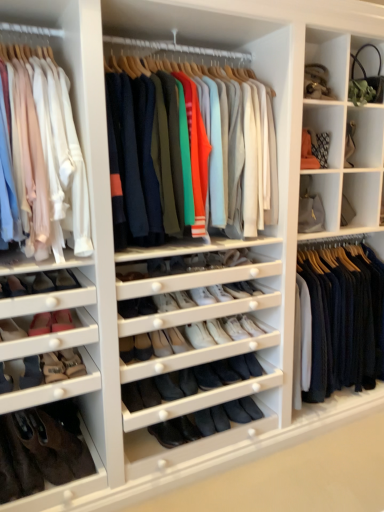
What do you see at coordinates (72, 362) in the screenshot?
I see `suede brown shoe at lower left, which is the 7th shoe in left-to-right order` at bounding box center [72, 362].

Measure the distance between brown suede shoe at lower left, arranged as the 8th shoe when viewed from the right, and camera.

brown suede shoe at lower left, arranged as the 8th shoe when viewed from the right, is 1.83 meters from camera.

Measure the distance between point (18, 326) and camera.

The depth of point (18, 326) is 6.13 feet.

Where is `matte white shirts at left, arranged as the first clothing when viewed from the left`? Image resolution: width=384 pixels, height=512 pixels. matte white shirts at left, arranged as the first clothing when viewed from the left is located at coordinates (47, 157).

Describe the element at coordinates (250, 325) in the screenshot. I see `white leather shoe at center, the 1th shoe when ordered from right to left` at that location.

Locate an element on the screen. The image size is (384, 512). suede brown shoe at lower left, the 4th shoe positioned from the right is located at coordinates (72, 362).

The image size is (384, 512). Find the location of `the 2nd clothing to the right of the matte white shirts at left, the third clothing viewed from the right, counting from the anchor's position`. the 2nd clothing to the right of the matte white shirts at left, the third clothing viewed from the right, counting from the anchor's position is located at coordinates (344, 318).

From a real-world perspective, who is located higher, dark blue knit sweater at center right, which is the 3th clothing from left to right, or matte white shirts at left, arranged as the first clothing when viewed from the left?

matte white shirts at left, arranged as the first clothing when viewed from the left, from a real-world perspective.

Considering the relative positions of dark blue knit sweater at center right, positioned as the first clothing in right-to-left order, and matte white shirts at left, arranged as the first clothing when viewed from the left, in the image provided, is dark blue knit sweater at center right, positioned as the first clothing in right-to-left order, to the left of matte white shirts at left, arranged as the first clothing when viewed from the left, from the viewer's perspective?

Incorrect, dark blue knit sweater at center right, positioned as the first clothing in right-to-left order, is not on the left side of matte white shirts at left, arranged as the first clothing when viewed from the left.

Between dark blue knit sweater at center right, positioned as the first clothing in right-to-left order, and matte white shirts at left, arranged as the first clothing when viewed from the left, which one is positioned behind?

Positioned behind is dark blue knit sweater at center right, positioned as the first clothing in right-to-left order.

Which is in front, matte pink shoe at lower left, positioned as the 6th shoe in right-to-left order, or black suede shoe at center, arranged as the third shoe when viewed from the right?

matte pink shoe at lower left, positioned as the 6th shoe in right-to-left order, is in front.

Consider the image. Is matte pink shoe at lower left, positioned as the 6th shoe in right-to-left order, with black suede shoe at center, arranged as the eighth shoe when viewed from the left?

No.

Which of these two, matte pink shoe at lower left, which is counted as the 5th shoe, starting from the left, or black suede shoe at center, arranged as the third shoe when viewed from the right, stands shorter?

black suede shoe at center, arranged as the third shoe when viewed from the right.

How many degrees apart are the facing directions of matte pink shoe at lower left, which is counted as the 5th shoe, starting from the left, and black suede shoe at center, arranged as the eighth shoe when viewed from the left?

They differ by 7.49 degrees in their facing directions.

Who is bigger, leather boot at lower left or matte pink shoe at lower left, which is counted as the seventh shoe, starting from the right?

With larger size is leather boot at lower left.

From a real-world perspective, is leather boot at lower left above or below matte pink shoe at lower left, which is counted as the seventh shoe, starting from the right?

leather boot at lower left is situated lower than matte pink shoe at lower left, which is counted as the seventh shoe, starting from the right, in the real world.

Is leather boot at lower left next to matte pink shoe at lower left, which is counted as the seventh shoe, starting from the right?

leather boot at lower left is not next to matte pink shoe at lower left, which is counted as the seventh shoe, starting from the right, and they're not touching.

Which object is further away from the camera, leather boot at lower left or matte pink shoe at lower left, placed as the fourth shoe when sorted from left to right?

leather boot at lower left.

Is matte pink shoe at lower left, which is counted as the seventh shoe, starting from the right, positioned beyond the bounds of black suede shoe at center, arranged as the third shoe when viewed from the right?

Yes, matte pink shoe at lower left, which is counted as the seventh shoe, starting from the right, is outside of black suede shoe at center, arranged as the third shoe when viewed from the right.

Based on the photo, is there a large distance between matte pink shoe at lower left, which is counted as the seventh shoe, starting from the right, and black suede shoe at center, arranged as the eighth shoe when viewed from the left?

Yes, matte pink shoe at lower left, which is counted as the seventh shoe, starting from the right, and black suede shoe at center, arranged as the eighth shoe when viewed from the left, are quite far apart.

Between matte pink shoe at lower left, placed as the fourth shoe when sorted from left to right, and black suede shoe at center, arranged as the third shoe when viewed from the right, which one is positioned behind?

black suede shoe at center, arranged as the third shoe when viewed from the right, is further from the camera.

Which object is wider, matte pink shoe at lower left, placed as the fourth shoe when sorted from left to right, or black suede shoe at center, arranged as the third shoe when viewed from the right?

black suede shoe at center, arranged as the third shoe when viewed from the right.

Is black suede shoe at center, arranged as the eighth shoe when viewed from the left, positioned beyond the bounds of black suede shoe at center, the 9th shoe from the left?

Indeed, black suede shoe at center, arranged as the eighth shoe when viewed from the left, is completely outside black suede shoe at center, the 9th shoe from the left.

Between black suede shoe at center, arranged as the third shoe when viewed from the right, and black suede shoe at center, the 9th shoe from the left, which one appears on the left side from the viewer's perspective?

Positioned to the left is black suede shoe at center, arranged as the third shoe when viewed from the right.

How many degrees apart are the facing directions of black suede shoe at center, arranged as the third shoe when viewed from the right, and black suede shoe at center, the 9th shoe from the left?

They differ by 0.198 degrees in their facing directions.

From the image's perspective, is black suede shoe at center, arranged as the eighth shoe when viewed from the left, located above black suede shoe at center, the 9th shoe from the left?

Yes, from the image's perspective, black suede shoe at center, arranged as the eighth shoe when viewed from the left, is on top of black suede shoe at center, the 9th shoe from the left.

From a real-world perspective, is matte pink shoe at lower left, which is counted as the 5th shoe, starting from the left, positioned under matte pink shoe at lower left, placed as the fourth shoe when sorted from left to right, based on gravity?

Yes, from a real-world perspective, matte pink shoe at lower left, which is counted as the 5th shoe, starting from the left, is below matte pink shoe at lower left, placed as the fourth shoe when sorted from left to right.

Is matte pink shoe at lower left, which is counted as the 5th shoe, starting from the left, turned away from matte pink shoe at lower left, which is counted as the seventh shoe, starting from the right?

matte pink shoe at lower left, which is counted as the 5th shoe, starting from the left, is not turned away from matte pink shoe at lower left, which is counted as the seventh shoe, starting from the right.

How distant is matte pink shoe at lower left, which is counted as the 5th shoe, starting from the left, from matte pink shoe at lower left, which is counted as the seventh shoe, starting from the right?

A distance of 7.95 inches exists between matte pink shoe at lower left, which is counted as the 5th shoe, starting from the left, and matte pink shoe at lower left, which is counted as the seventh shoe, starting from the right.

From a real-world perspective, is white leather shoe at center, marked as the 10th shoe in a left-to-right arrangement, under matte pink shoe at lower left, the second shoe from the left?

Correct, in the physical world, white leather shoe at center, marked as the 10th shoe in a left-to-right arrangement, is lower than matte pink shoe at lower left, the second shoe from the left.

What's the angular difference between white leather shoe at center, the 1th shoe when ordered from right to left, and matte pink shoe at lower left, the 9th shoe when ordered from right to left,'s facing directions?

They differ by 8.85 degrees in their facing directions.

Is white leather shoe at center, marked as the 10th shoe in a left-to-right arrangement, touching matte pink shoe at lower left, the 9th shoe when ordered from right to left?

No, white leather shoe at center, marked as the 10th shoe in a left-to-right arrangement, is not next to matte pink shoe at lower left, the 9th shoe when ordered from right to left.

Can you confirm if white leather shoe at center, the 1th shoe when ordered from right to left, is positioned to the right of matte pink shoe at lower left, the 9th shoe when ordered from right to left?

Yes.

Find the location of `the 2nd clothing located beneath the matte white shirts at left, arranged as the first clothing when viewed from the left (from a real-world perspective)`. the 2nd clothing located beneath the matte white shirts at left, arranged as the first clothing when viewed from the left (from a real-world perspective) is located at coordinates (344, 318).

From the image's perspective, which shoe is the 6th one above the black suede shoe at center, arranged as the eighth shoe when viewed from the left? Please provide its 2D coordinates.

[(61, 320)]

When comparing their distances from black suede shoe at center, arranged as the third shoe when viewed from the right, does matte white shirts at left, arranged as the first clothing when viewed from the left, or black suede shoe at center, the 9th shoe from the left, seem further?

matte white shirts at left, arranged as the first clothing when viewed from the left, is further to black suede shoe at center, arranged as the third shoe when viewed from the right.

Looking at the image, which one is located further to dark blue knit sweater at center right, which is the 3th clothing from left to right, matte pink shoe at lower left, which is counted as the 5th shoe, starting from the left, or brown suede shoe at lower left, arranged as the 8th shoe when viewed from the right?

brown suede shoe at lower left, arranged as the 8th shoe when viewed from the right.

Looking at the image, which one is located further to suede black shoe at lower left, which is the first shoe in left-to-right order, matte pink shoe at lower left, the second shoe from the left, or knit sweater at center, acting as the 2th clothing starting from the left?

knit sweater at center, acting as the 2th clothing starting from the left, lies further to suede black shoe at lower left, which is the first shoe in left-to-right order, than the other object.

Looking at the image, which one is located closer to suede brown shoe at lower left, which is the 7th shoe in left-to-right order, matte white shirts at left, arranged as the first clothing when viewed from the left, or black suede shoe at lower left, the fifth shoe viewed from the right?

black suede shoe at lower left, the fifth shoe viewed from the right.

In the scene shown: Looking at the image, which one is located further to matte white shirts at left, arranged as the first clothing when viewed from the left, white leather shoe at center, marked as the 10th shoe in a left-to-right arrangement, or leather boot at lower left?

white leather shoe at center, marked as the 10th shoe in a left-to-right arrangement, is positioned further to the anchor matte white shirts at left, arranged as the first clothing when viewed from the left.

From the image, which object appears to be nearer to matte pink shoe at lower left, which is counted as the seventh shoe, starting from the right, matte white shirts at left, the third clothing viewed from the right, or black suede shoe at lower left, the fifth shoe viewed from the right?

The object closer to matte pink shoe at lower left, which is counted as the seventh shoe, starting from the right, is black suede shoe at lower left, the fifth shoe viewed from the right.

From the image, which object appears to be farther from suede brown shoe at lower left, which is the 7th shoe in left-to-right order, matte white shirts at left, the third clothing viewed from the right, or matte pink shoe at lower left, positioned as the 6th shoe in right-to-left order?

matte white shirts at left, the third clothing viewed from the right, is positioned further to the anchor suede brown shoe at lower left, which is the 7th shoe in left-to-right order.

From the picture: Considering their positions, is dark blue knit sweater at center right, which is the 3th clothing from left to right, positioned further to matte white shirts at left, the third clothing viewed from the right, than matte pink shoe at lower left, the second shoe from the left?

The object further to matte white shirts at left, the third clothing viewed from the right, is dark blue knit sweater at center right, which is the 3th clothing from left to right.

This screenshot has width=384, height=512. What are the coordinates of `footwear between brown suede shoe at lower left, arranged as the 8th shoe when viewed from the right, and dark blue knit sweater at center right, positioned as the first clothing in right-to-left order, in the horizontal direction` in the screenshot? It's located at (44, 451).

The image size is (384, 512). Find the location of `footwear between matte pink shoe at lower left, placed as the fourth shoe when sorted from left to right, and brown suede shoe at lower left, placed as the third shoe when sorted from left to right, in the up-down direction`. footwear between matte pink shoe at lower left, placed as the fourth shoe when sorted from left to right, and brown suede shoe at lower left, placed as the third shoe when sorted from left to right, in the up-down direction is located at coordinates (44, 451).

Identify the location of footwear between knit sweater at center, acting as the 2th clothing starting from the left, and black suede shoe at center, arranged as the eighth shoe when viewed from the left, from top to bottom. tap(44, 451).

Identify the location of footwear between suede black shoe at lower left, which is the first shoe in left-to-right order, and black suede shoe at center, arranged as the eighth shoe when viewed from the left, from left to right. (44, 451).